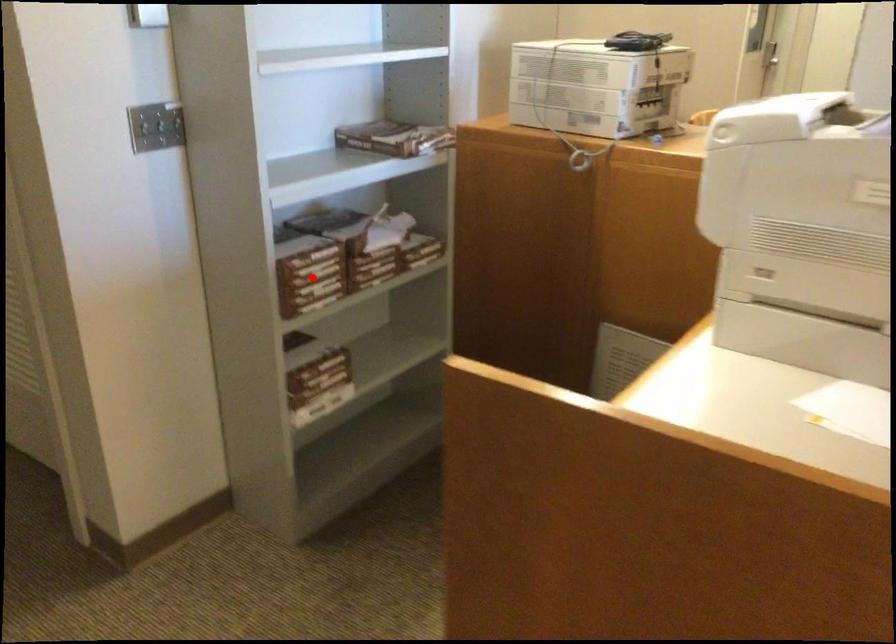
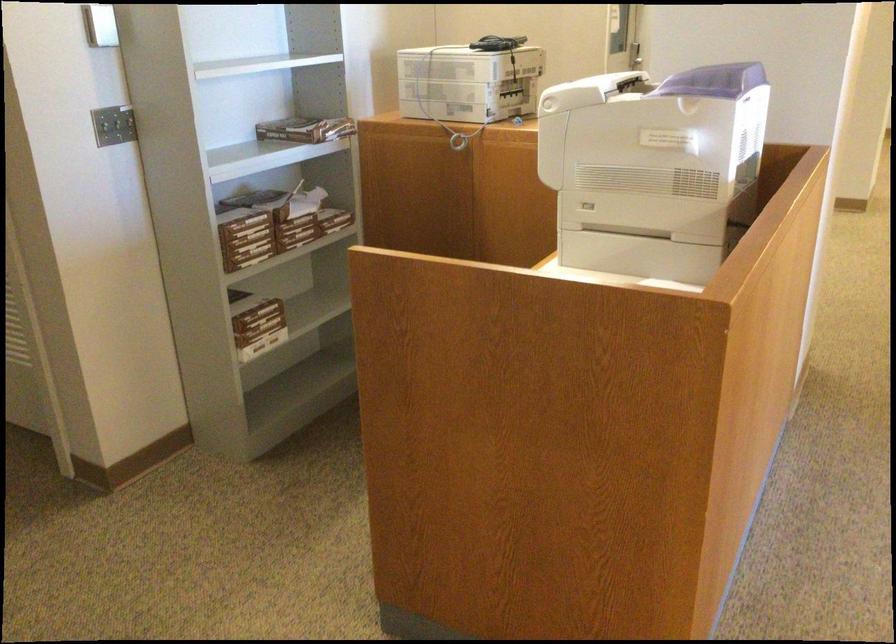
Locate, in the second image, the point that corresponds to the highlighted location in the first image.

(246, 237)